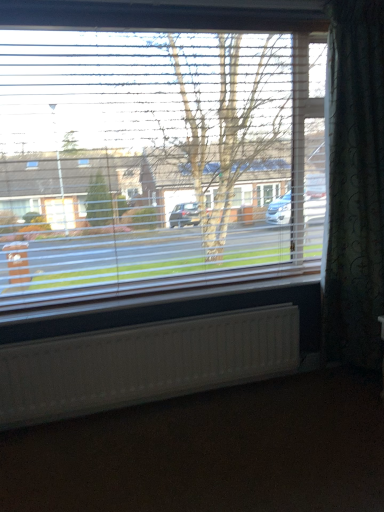
Question: From the image's perspective, would you say brown matte carpet at lower center is positioned over transparent plastic blinds at upper center?

Choices:
 (A) no
 (B) yes

Answer: (A)

Question: Is brown matte carpet at lower center oriented away from transparent plastic blinds at upper center?

Choices:
 (A) no
 (B) yes

Answer: (A)

Question: Does brown matte carpet at lower center have a larger size compared to transparent plastic blinds at upper center?

Choices:
 (A) yes
 (B) no

Answer: (B)

Question: Considering the relative positions of brown matte carpet at lower center and transparent plastic blinds at upper center in the image provided, is brown matte carpet at lower center in front of transparent plastic blinds at upper center?

Choices:
 (A) no
 (B) yes

Answer: (B)

Question: From the image's perspective, is brown matte carpet at lower center located beneath transparent plastic blinds at upper center?

Choices:
 (A) no
 (B) yes

Answer: (B)

Question: Can you confirm if brown matte carpet at lower center is wider than transparent plastic blinds at upper center?

Choices:
 (A) yes
 (B) no

Answer: (A)

Question: Could you tell me if brown matte carpet at lower center is facing dark green textured curtain at right?

Choices:
 (A) no
 (B) yes

Answer: (A)

Question: Does brown matte carpet at lower center have a lesser height compared to dark green textured curtain at right?

Choices:
 (A) no
 (B) yes

Answer: (B)

Question: Can you confirm if brown matte carpet at lower center is taller than dark green textured curtain at right?

Choices:
 (A) yes
 (B) no

Answer: (B)

Question: From a real-world perspective, does brown matte carpet at lower center stand above dark green textured curtain at right?

Choices:
 (A) no
 (B) yes

Answer: (A)

Question: Can you confirm if brown matte carpet at lower center is smaller than dark green textured curtain at right?

Choices:
 (A) yes
 (B) no

Answer: (A)

Question: Is dark green textured curtain at right located within brown matte carpet at lower center?

Choices:
 (A) no
 (B) yes

Answer: (A)

Question: From a real-world perspective, is dark green textured curtain at right on top of brown matte carpet at lower center?

Choices:
 (A) yes
 (B) no

Answer: (A)